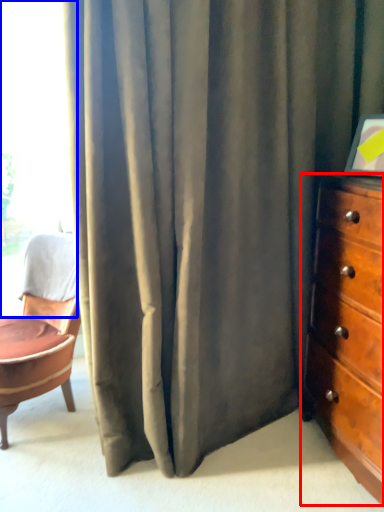
Question: Which point is further to the camera, chest of drawers (highlighted by a red box) or window (highlighted by a blue box)?

Choices:
 (A) chest of drawers
 (B) window

Answer: (B)